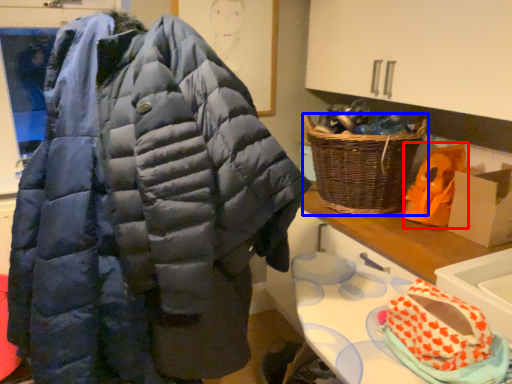
Question: Which of the following is the closest to the observer, stuff (highlighted by a red box) or picnic basket (highlighted by a blue box)?

Choices:
 (A) stuff
 (B) picnic basket

Answer: (B)